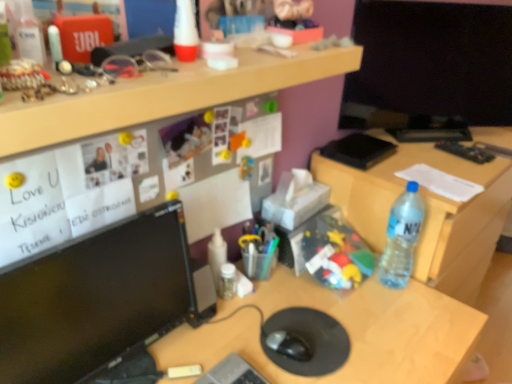
The image size is (512, 384). Find the location of `vacant space that is to the left of transparent plastic remote control at right`. vacant space that is to the left of transparent plastic remote control at right is located at coordinates (425, 152).